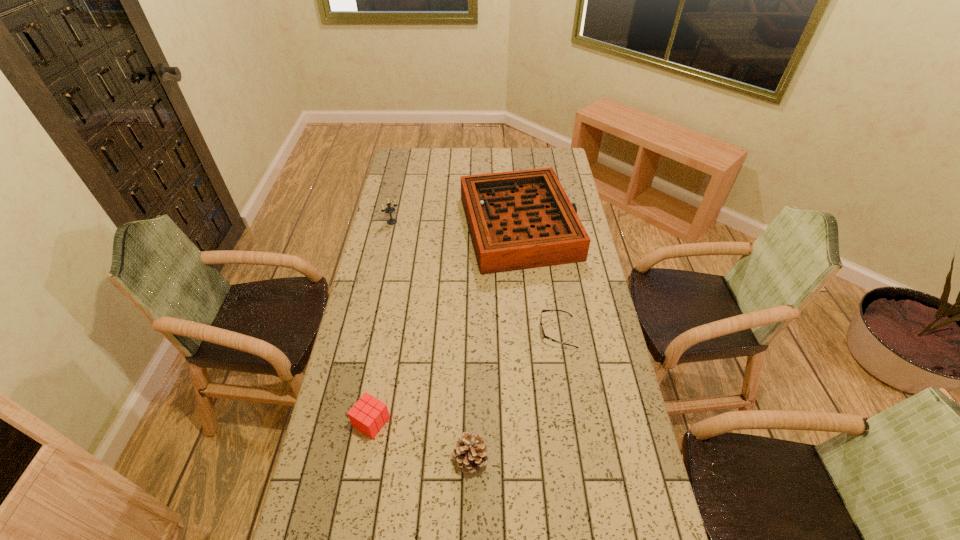
This screenshot has height=540, width=960. I want to click on vacant area between the nearest object and the candle holder, so pyautogui.click(x=431, y=340).

Find the location of a particular element. This screenshot has width=960, height=540. blank region between the nearest object and the candle holder is located at coordinates (431, 340).

At what (x,y) coordinates should I click in order to perform the action: click on object that is the second closest to the third nearest object. Please return your answer as a coordinate pair (x, y). The width and height of the screenshot is (960, 540). Looking at the image, I should click on (470, 453).

Identify which object is the fourth closest to the gameboard. Please provide its 2D coordinates. Your answer should be formatted as a tuple, i.e. [(x, y)], where the tuple contains the x and y coordinates of a point satisfying the conditions above.

[(470, 453)]

This screenshot has height=540, width=960. Find the location of `vacant area that satisfies the following two spatial constraints: 1. on the front side of the fourth tallest object; 2. on the left side of the candle holder`. vacant area that satisfies the following two spatial constraints: 1. on the front side of the fourth tallest object; 2. on the left side of the candle holder is located at coordinates [348, 422].